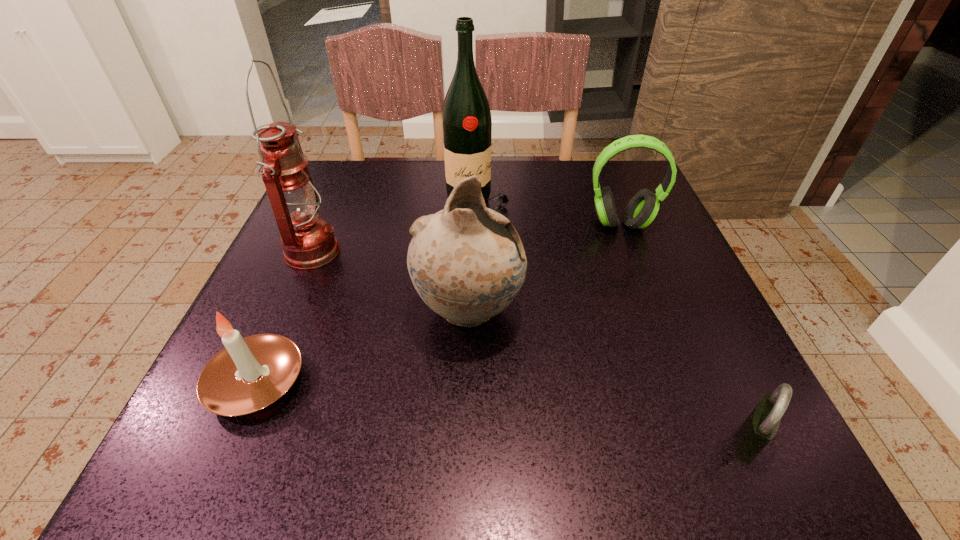
The image size is (960, 540). Identify the location of wine bottle. (466, 118).

Image resolution: width=960 pixels, height=540 pixels. I want to click on oil lamp, so click(308, 241).

At what (x,y) coordinates should I click in order to perform the action: click on pottery. Please return your answer as a coordinate pair (x, y). This screenshot has height=540, width=960. Looking at the image, I should click on (467, 262).

The image size is (960, 540). I want to click on the third shortest object, so click(x=643, y=207).

Find the location of `candle`. candle is located at coordinates (249, 374).

This screenshot has height=540, width=960. I want to click on the shortest object, so click(761, 425).

Where is `free space located on the right of the wine bottle`? free space located on the right of the wine bottle is located at coordinates (560, 202).

Locate an element on the screen. This screenshot has width=960, height=540. vacant position located on the right of the oil lamp is located at coordinates (488, 253).

Where is `vacant region located 0.100m from the spout of the fourth shortest object`? The image size is (960, 540). vacant region located 0.100m from the spout of the fourth shortest object is located at coordinates tap(579, 310).

At what (x,y) coordinates should I click in order to perform the action: click on vacant space located on the back of the fourth tallest object. Please return your answer as a coordinate pair (x, y). The width and height of the screenshot is (960, 540). Looking at the image, I should click on (599, 170).